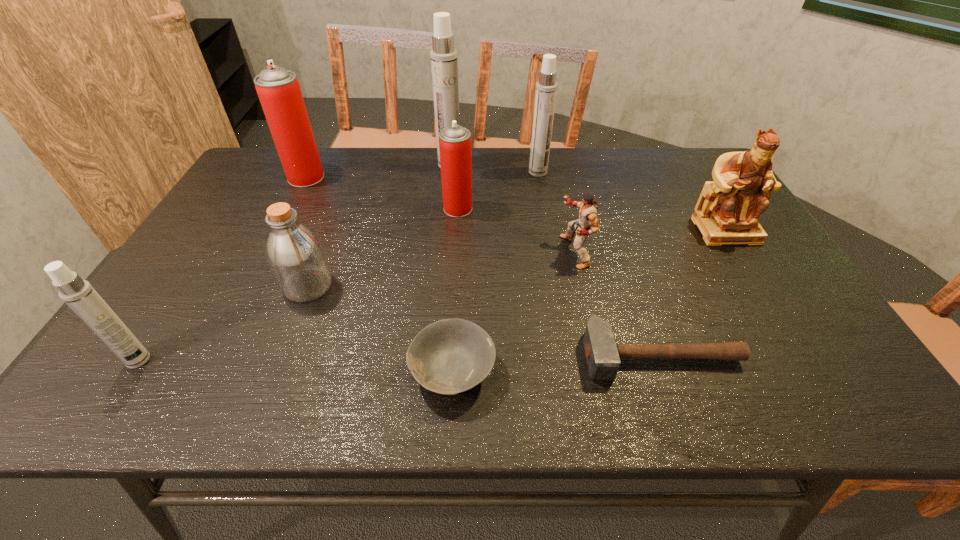
I want to click on white aerosol can that is the closest one to the second smallest white aerosol can, so click(444, 61).

Where is `white aerosol can that can be found as the closest to the leftmost object`? white aerosol can that can be found as the closest to the leftmost object is located at coordinates (444, 61).